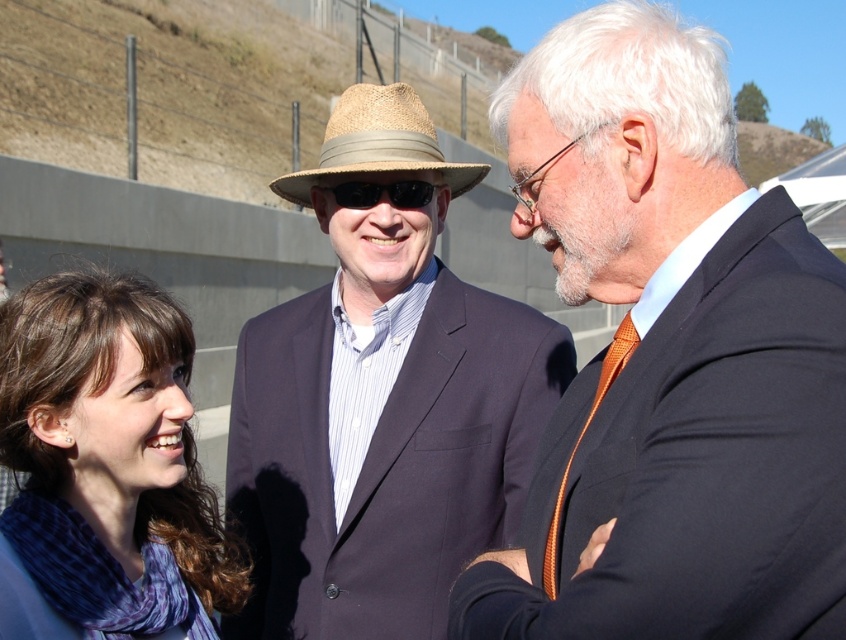
Question: Among these points, which one is farthest from the camera?

Choices:
 (A) (143, 605)
 (B) (356, 128)
 (C) (411, 195)

Answer: (C)

Question: Which object is closer to the camera taking this photo?

Choices:
 (A) strawhat at center
 (B) blue plaid scarf at lower left
 (C) matte black suit at center

Answer: (C)

Question: Can you confirm if matte straw hat at center is smaller than strawhat at center?

Choices:
 (A) yes
 (B) no

Answer: (A)

Question: Does orange woven tie at center have a greater width compared to black plastic sunglasses at center?

Choices:
 (A) no
 (B) yes

Answer: (A)

Question: Based on their relative distances, which object is farther from the strawhat at center?

Choices:
 (A) black plastic sunglasses at center
 (B) blue plaid scarf at lower left
 (C) orange woven tie at center
 (D) matte straw hat at center

Answer: (B)

Question: Does strawhat at center appear over black plastic sunglasses at center?

Choices:
 (A) yes
 (B) no

Answer: (A)